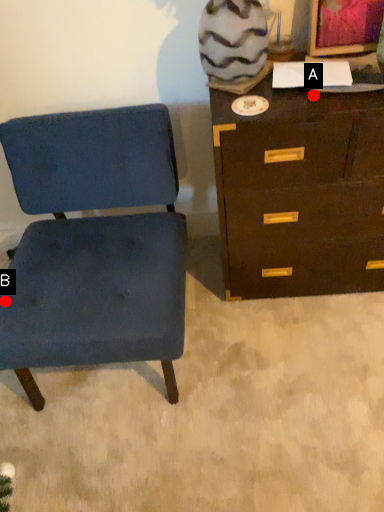
Question: Two points are circled on the image, labeled by A and B beside each circle. Which point is closer to the camera?

Choices:
 (A) A is closer
 (B) B is closer

Answer: (A)